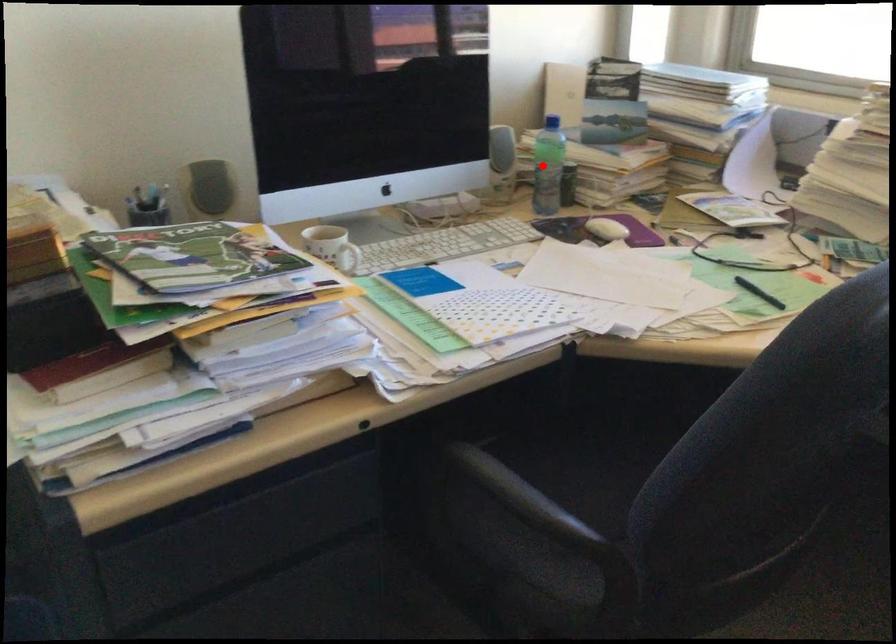
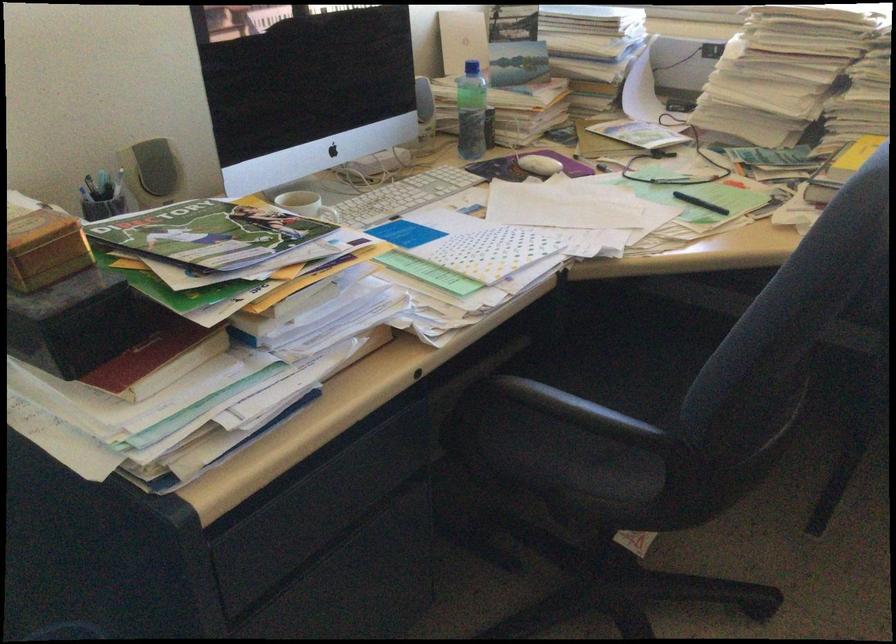
The point at the highlighted location is marked in the first image. Where is the corresponding point in the second image?

(470, 111)